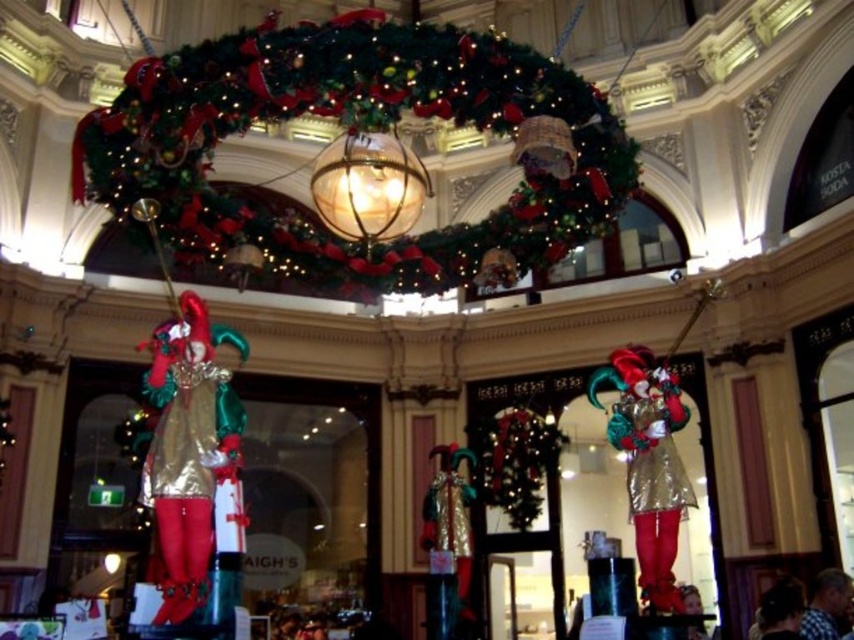
What do you see at coordinates (354, 138) in the screenshot?
I see `green velvet wreath at upper center` at bounding box center [354, 138].

Image resolution: width=854 pixels, height=640 pixels. What are the coordinates of `green velvet wreath at upper center` in the screenshot? It's located at (354, 138).

Does point (472, 269) come behind point (673, 445)?

That is True.

You are a GUI agent. You are given a task and a screenshot of the screen. Output one action in this format:
    pyautogui.click(x=<x>, y=<y>)
    Task: Click on the green velvet wreath at upper center
    The height and width of the screenshot is (640, 854).
    Given the screenshot: What is the action you would take?
    pyautogui.click(x=354, y=138)

From the picture: Between green velvet wreath at upper center and metallic gold jester at left, which one has less height?

green velvet wreath at upper center

Where is `green velvet wreath at upper center`? Image resolution: width=854 pixels, height=640 pixels. green velvet wreath at upper center is located at coordinates (354, 138).

Locate an element on the screen. green velvet wreath at upper center is located at coordinates (354, 138).

Which is above, metallic gold jester at left or metallic gold jester at center?

metallic gold jester at center is higher up.

Image resolution: width=854 pixels, height=640 pixels. In order to click on metallic gold jester at left in this screenshot , I will do [191, 451].